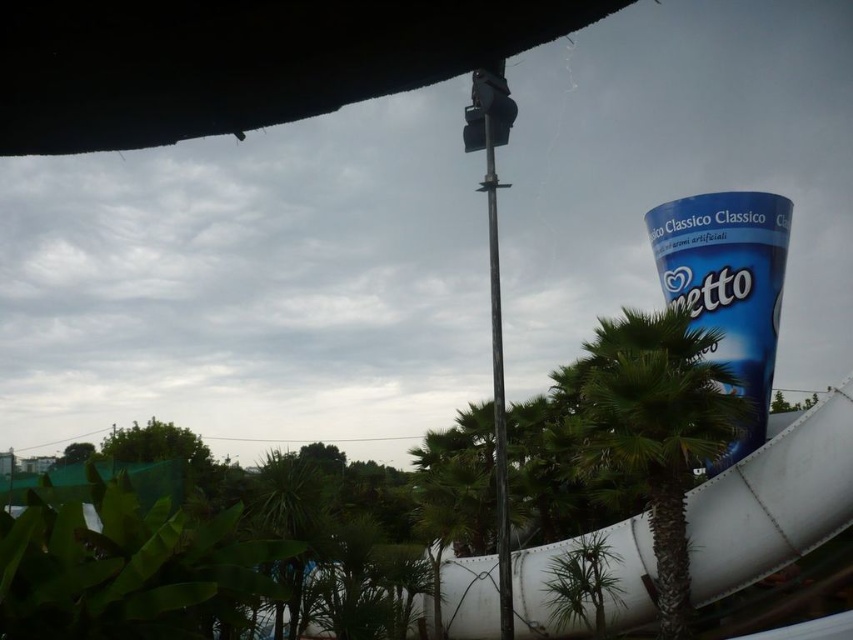
Consider the image. Which is above, black matte canopy at upper center or green leafy palm tree at right?

black matte canopy at upper center is above.

Who is taller, black matte canopy at upper center or green leafy palm tree at right?

Standing taller between the two is green leafy palm tree at right.

Does point (357, 45) come behind point (585, 406)?

No, (357, 45) is in front of (585, 406).

Locate an element on the screen. This screenshot has width=853, height=640. black matte canopy at upper center is located at coordinates (239, 60).

Can you confirm if white matte slide at right is bigger than green leafy palm tree at center?

Incorrect, white matte slide at right is not larger than green leafy palm tree at center.

At what (x,y) coordinates should I click in order to perform the action: click on white matte slide at right. Please return your answer as a coordinate pair (x, y). The image size is (853, 640). Looking at the image, I should click on (773, 499).

What do you see at coordinates (773, 499) in the screenshot? Image resolution: width=853 pixels, height=640 pixels. I see `white matte slide at right` at bounding box center [773, 499].

I want to click on white matte slide at right, so click(x=773, y=499).

Locate an element on the screen. white matte slide at right is located at coordinates (773, 499).

Does point (758, 528) come behind point (753, 419)?

No, (758, 528) is in front of (753, 419).

Find the location of a particular element. The height and width of the screenshot is (640, 853). white matte slide at right is located at coordinates click(x=773, y=499).